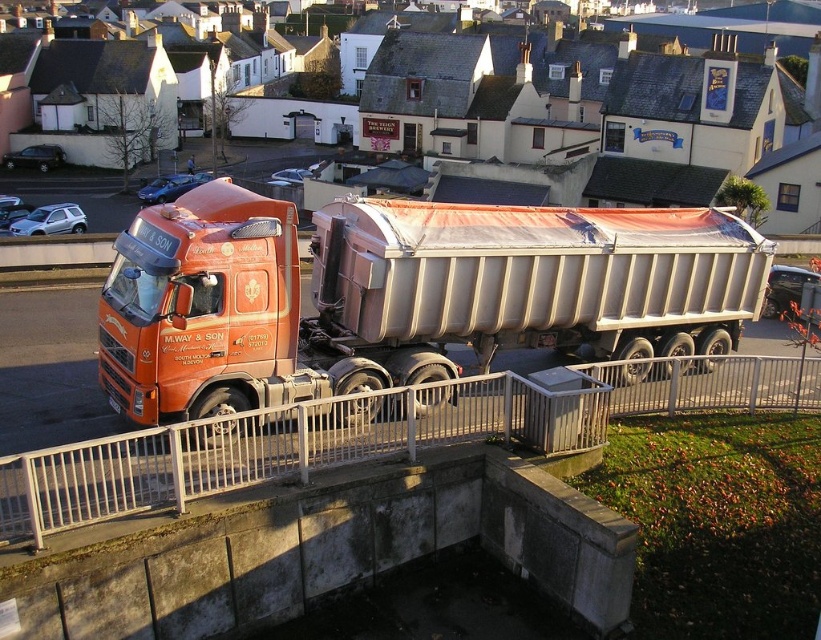
How distant is matte orange trailer truck at center from metallic silver railing at lower center?

matte orange trailer truck at center is 7.42 feet away from metallic silver railing at lower center.

What do you see at coordinates (402, 294) in the screenshot?
I see `matte orange trailer truck at center` at bounding box center [402, 294].

Identify the location of matte orange trailer truck at center. (402, 294).